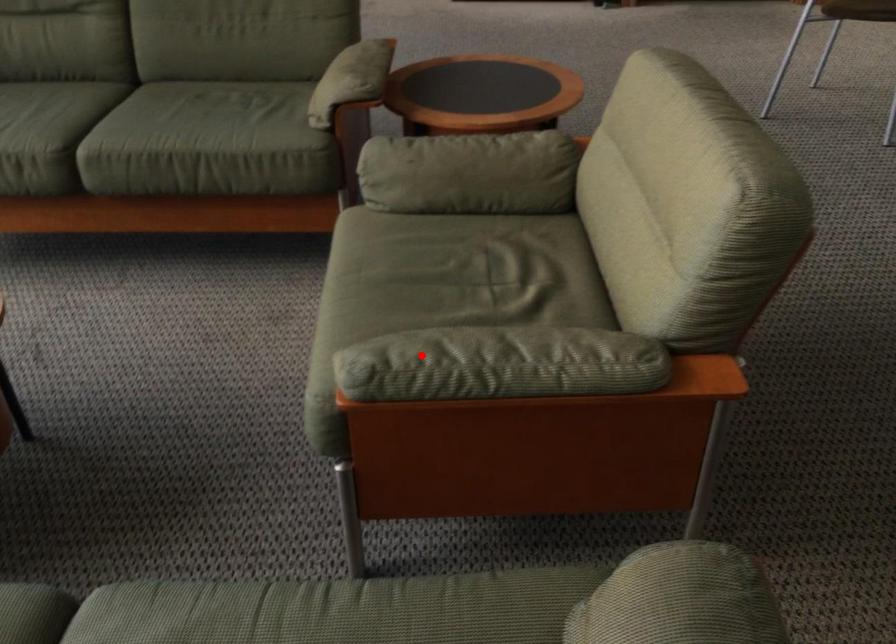
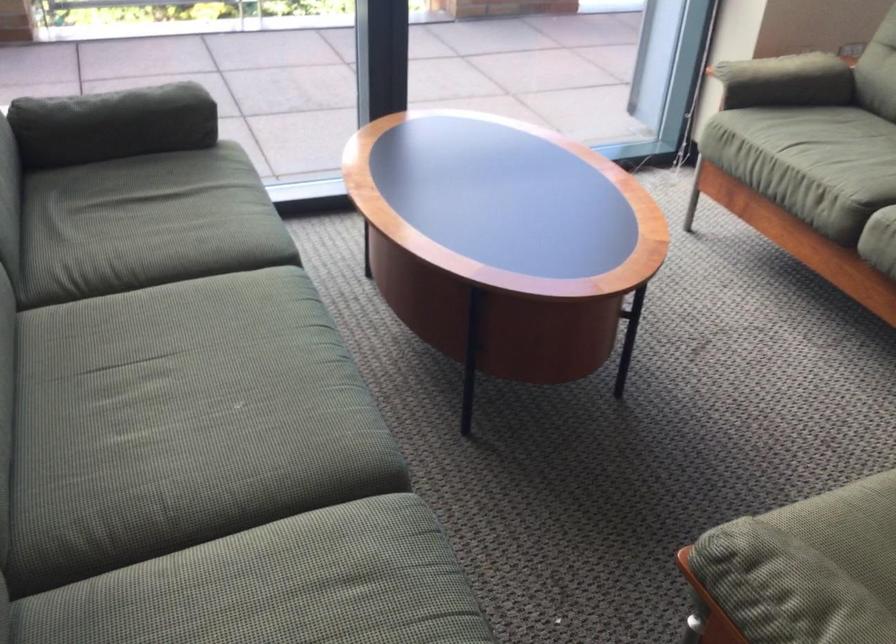
The point at the highlighted location is marked in the first image. Where is the corresponding point in the second image?

(785, 588)